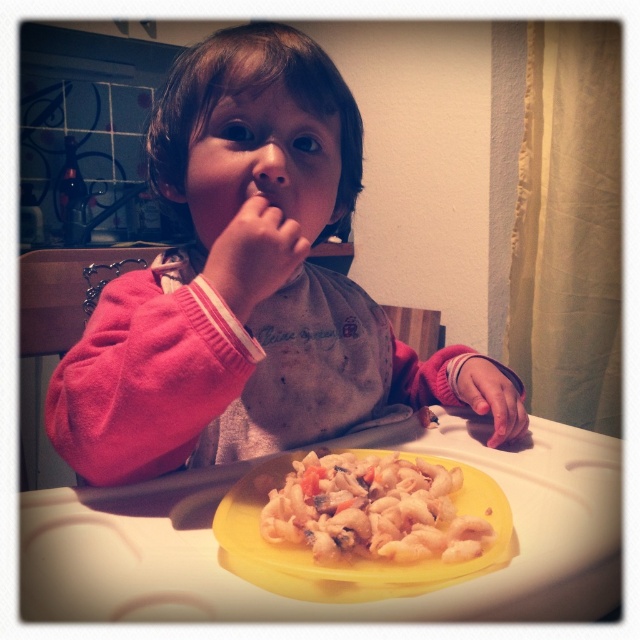
You are a photographer trying to capture the child in the scene. You want to ensure both the pink fleece sweater at center and the pink fleece sleeve at lower right are visible in the frame. Based on their positions, which object should you prioritize keeping in the left half of your camera viewfinder?

The pink fleece sweater at center should be prioritized in the left half of the viewfinder since it is positioned to the left of the pink fleece sleeve at lower right.

You are a parent trying to place a spoon on the table for your child. The spoon is 6 inches long. If you want to put the spoon between the yellow plastic tray at center and the pink fleece sleeve at lower right, will it fit without overlapping either object?

The yellow plastic tray at center and pink fleece sleeve at lower right are 6.14 inches apart. Since the spoon is 6 inches long, it can fit between them without overlapping either object as there is enough space.